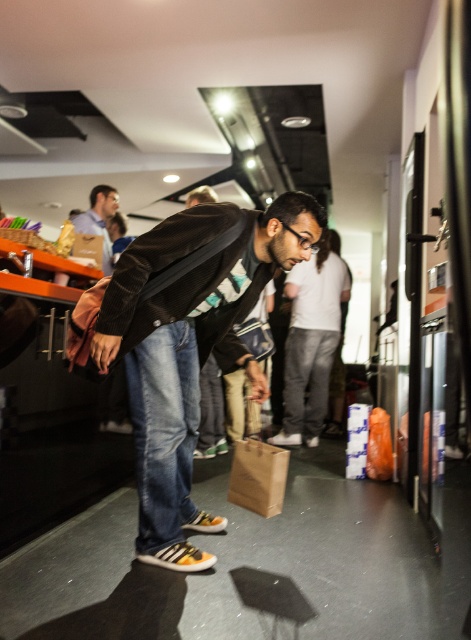
You are a customer in the cafe and want to find the dark brown leather jacket at center. Where would you look based on the coordinates provided?

The dark brown leather jacket at center is located at coordinates point (189, 348), which is slightly to the right and above the center of the image.

You are standing at point A, which is at coordinates point (206,291). You want to walk to point B, which is at coordinates point (97,228). Which direction should you move in to reach point B from point A?

To reach point B from point A, you should move backward since point A is in front of point B according to their coordinates.

You are a photographer standing in the scene and want to take a clear photo of both the dark brown leather jacket at center and the matte blue shirt at upper left. Which object will appear larger in your photo?

The dark brown leather jacket at center will appear larger in the photo because it is closer to the viewer than the matte blue shirt at upper left.